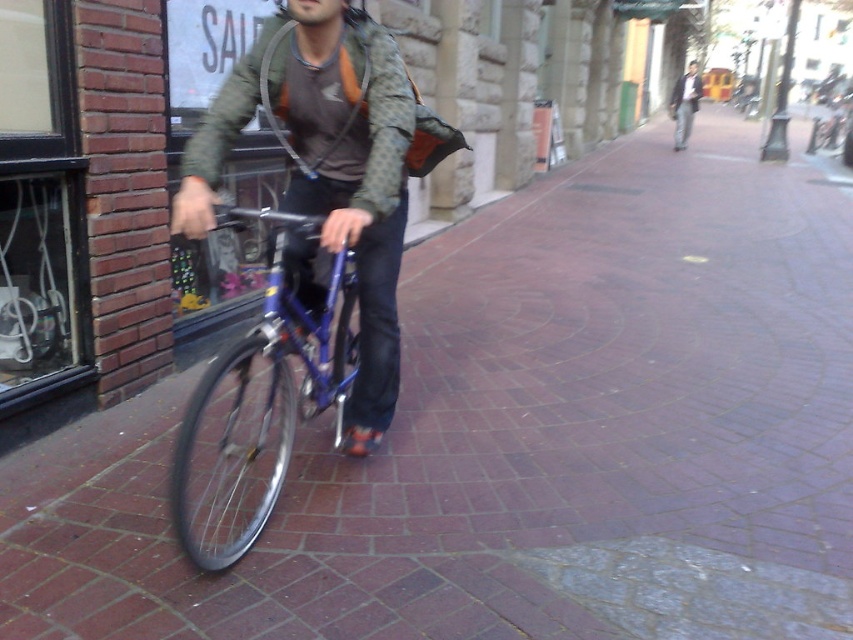
You are a pedestrian walking on the sidewalk and see the dark gray jacket at upper center and the brown fabric helmet at center. Which object is higher from the ground?

The dark gray jacket at upper center is much taller as brown fabric helmet at center, so the dark gray jacket at upper center is higher from the ground.

You are standing on the sidewalk and see two points marked on the ground. The first point is at coordinate point (364, 65) and the second is at point (279, 452). Which point is closer to you?

Point (364, 65) is closer to the viewer than point (279, 452).

You are a delivery person who needs to choose a bicycle to carry heavy packages. You are standing on the sidewalk and see both the matte blue bicycle at center and the shiny blue bicycle at center. Which bicycle would be more suitable for carrying heavy loads based on their height?

The matte blue bicycle at center is taller than the shiny blue bicycle at center, so it would be more suitable for carrying heavy loads as taller bicycles typically have a stronger frame and better weight distribution.